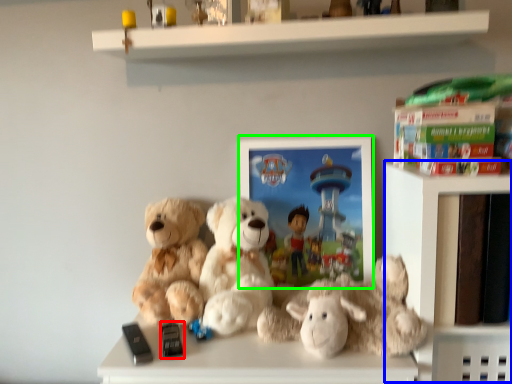
Question: Which is nearer to the toy (highlighted by a red box)? shelf (highlighted by a blue box) or picture frame (highlighted by a green box).

Choices:
 (A) shelf
 (B) picture frame

Answer: (B)